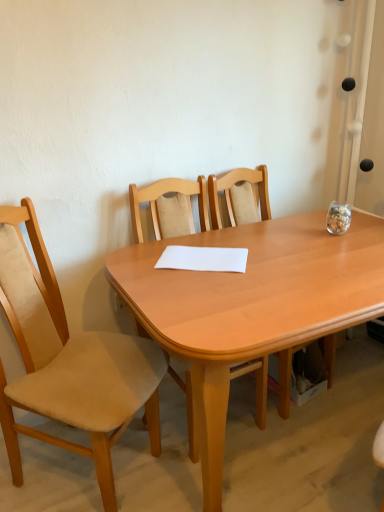
Locate an element on the screen. The image size is (384, 512). free point above white paper at center (from a real-world perspective) is located at coordinates (200, 254).